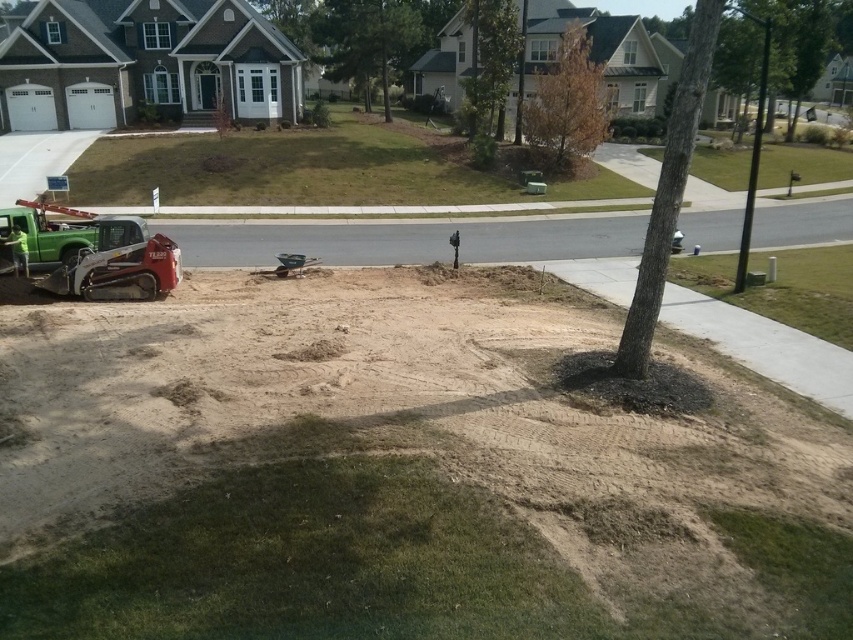
You are a delivery person trying to navigate a narrow path between two brown textured trees in a construction site. The trees are labeled as the brown textured tree at upper center and the brown textured tree at center. Can you pass through the space between them?

The brown textured tree at upper center is positioned under the brown textured tree at center, meaning there is no space between them for you to pass through. You will need to find an alternative route around the trees.

You are a landscape architect designing a garden path between the brown textured tree at lower right and the brown textured tree at center. Which tree should you place the starting point of the path closer to if you want the path to curve towards the right as it progresses?

The path should start closer to the brown textured tree at center because the brown textured tree at lower right is positioned to the right of the brown textured tree at center. This arrangement allows the path to naturally curve towards the right as it moves from the center tree towards the right tree.

You are a landscape architect designing a garden layout. You need to place a new bench between the brown textured tree at lower right and the brown textured tree at center. Considering their heights, which tree will provide more shade over the bench during midday?

The brown textured tree at lower right has a greater height compared to the brown textured tree at center, so it will provide more shade over the bench during midday.